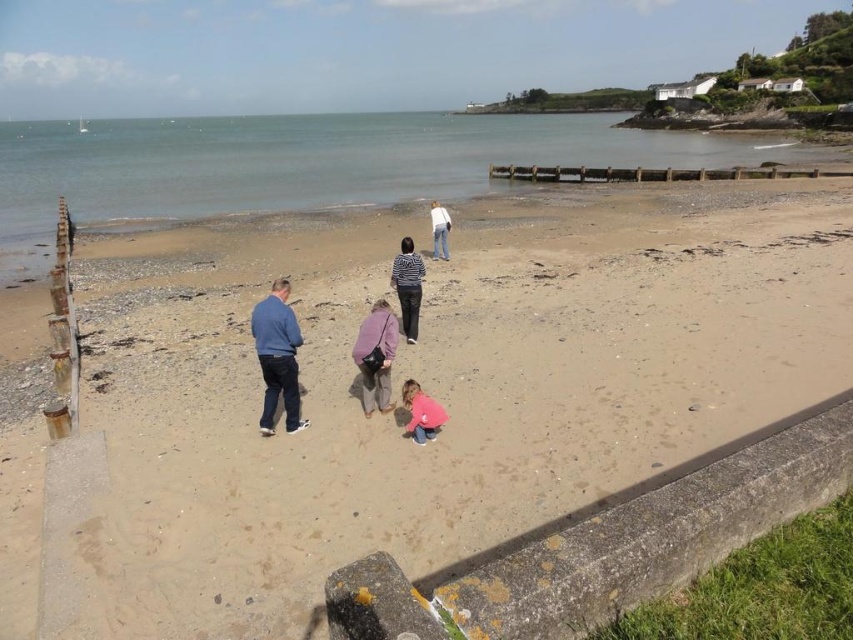
You are a photographer positioned at the edge of the beach scene. You want to capture a photo that includes both the blue cotton shirt at lower left and the striped fabric shirt at center. Based on their positions, which shirt should you adjust your camera angle to focus on first to ensure both are in frame?

The blue cotton shirt at lower left is below the striped fabric shirt at center, so you should adjust your camera angle to focus on the blue cotton shirt at lower left first to ensure both are in frame.